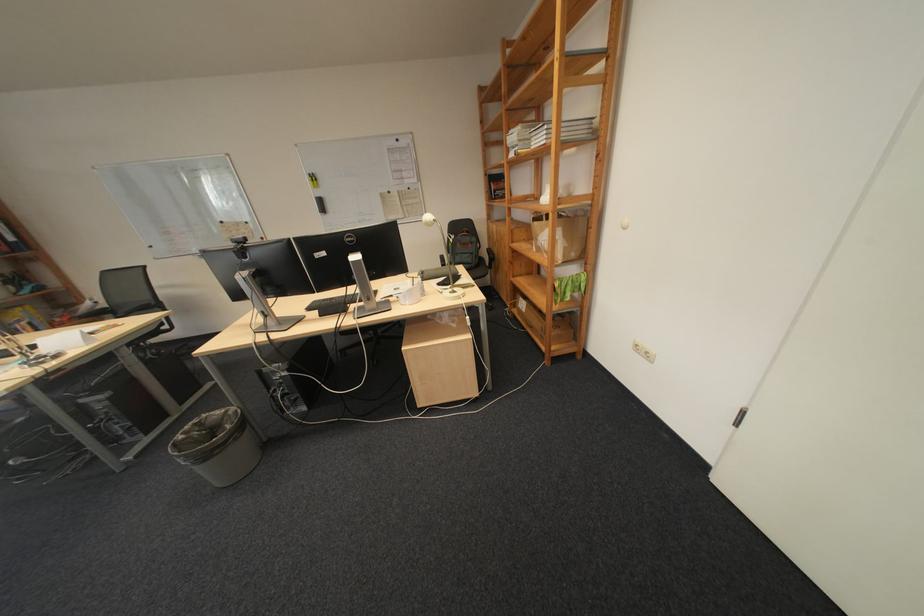
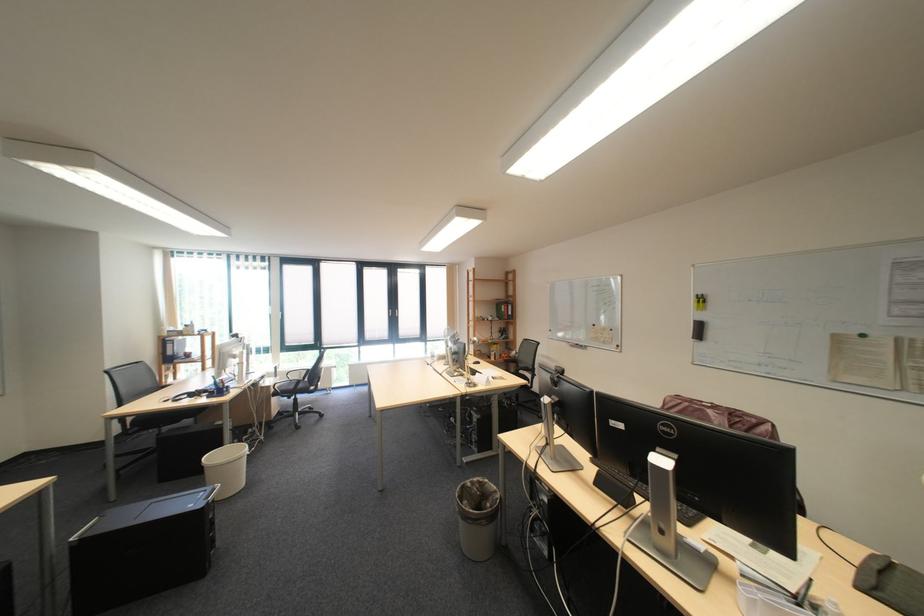
Find the pixel in the second image that matches the point at 198,435 in the first image.

(485, 484)